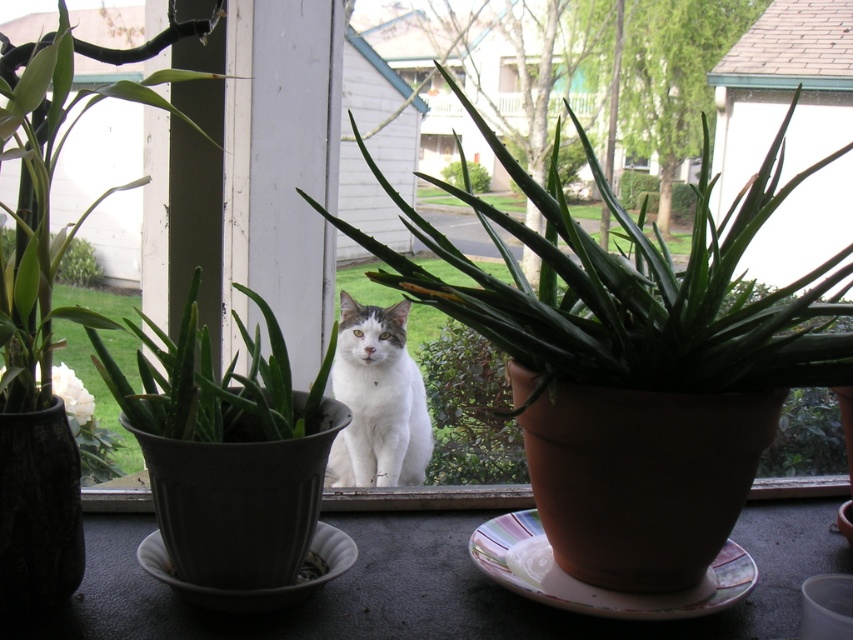
Question: Among these objects, which one is farthest from the camera?

Choices:
 (A) green leafy plant at center
 (B) white soft fur cat at center
 (C) green matte aloe vera at center
 (D) green matte plant at left

Answer: (A)

Question: Is green matte plant at left bigger than green leafy plant at center?

Choices:
 (A) yes
 (B) no

Answer: (A)

Question: Can you confirm if green matte aloe vera at center is positioned to the left of green matte plant at left?

Choices:
 (A) yes
 (B) no

Answer: (B)

Question: Which object is the closest to the green leafy plant at center?

Choices:
 (A) green matte plant at left
 (B) white soft fur cat at center
 (C) green matte aloe vera at center

Answer: (B)

Question: Among these objects, which one is farthest from the camera?

Choices:
 (A) green matte aloe vera at center
 (B) green matte plant at left
 (C) white soft fur cat at center
 (D) green leafy plant at center

Answer: (D)

Question: In this image, where is green matte plant at left located relative to green leafy plant at center?

Choices:
 (A) above
 (B) below

Answer: (B)